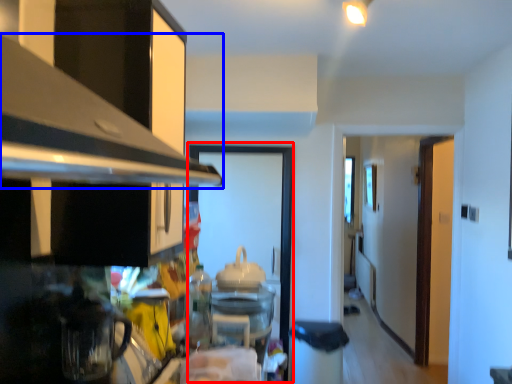
Question: Which object is closer to the camera taking this photo, glass door (highlighted by a red box) or exhaust hood (highlighted by a blue box)?

Choices:
 (A) glass door
 (B) exhaust hood

Answer: (B)